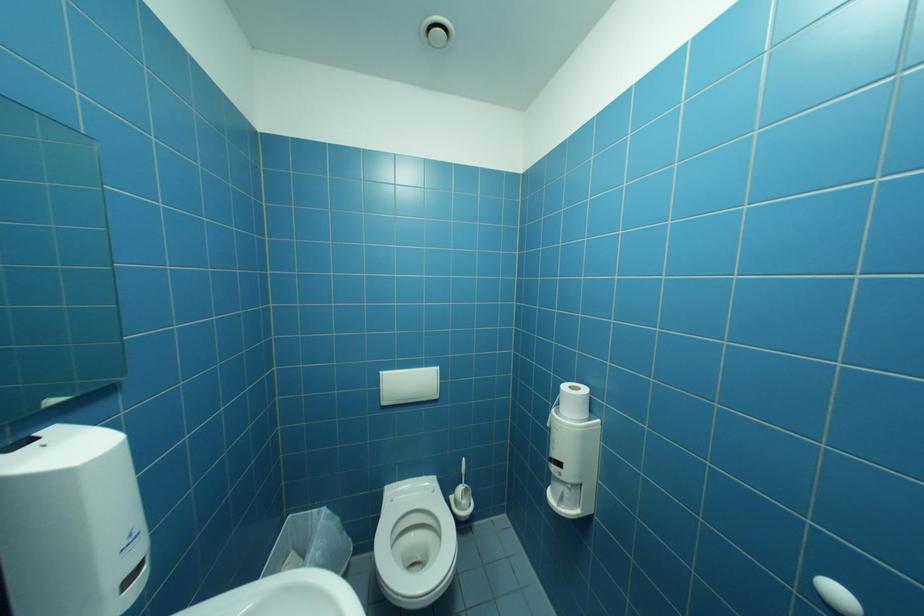
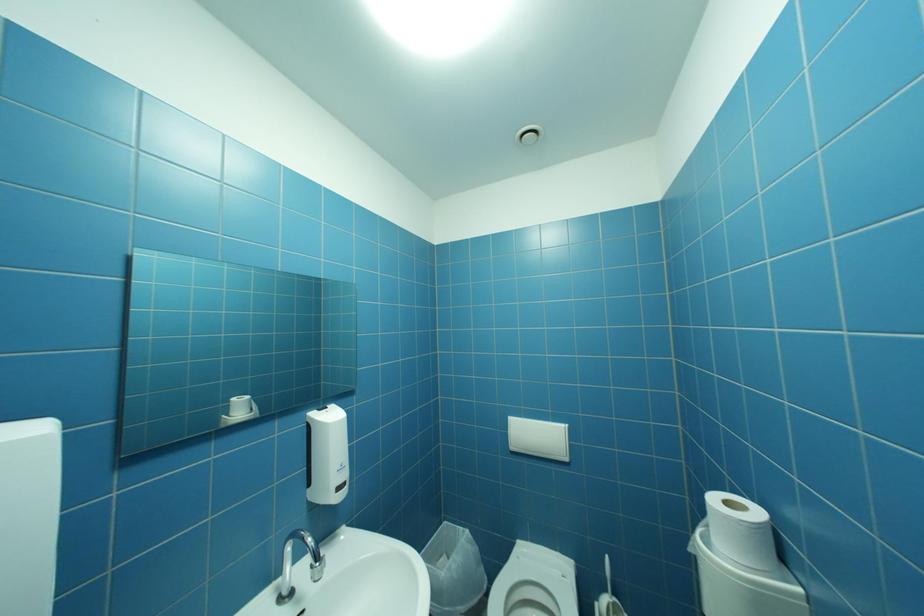
Question: The camera is either moving clockwise (left) or counter-clockwise (right) around the object. The first image is from the beginning of the video and the second image is from the end. Is the camera moving left or right when shooting the video?

Choices:
 (A) Left
 (B) Right

Answer: (B)